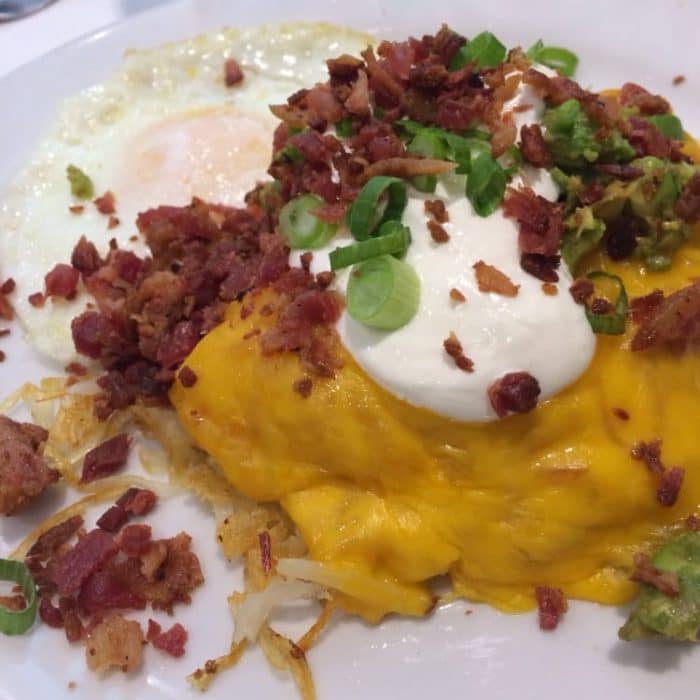
At what (x,y) coordinates should I click in order to perform the action: click on white table. Please return your answer as a coordinate pair (x, y). This screenshot has height=700, width=700. Looking at the image, I should click on (49, 34).